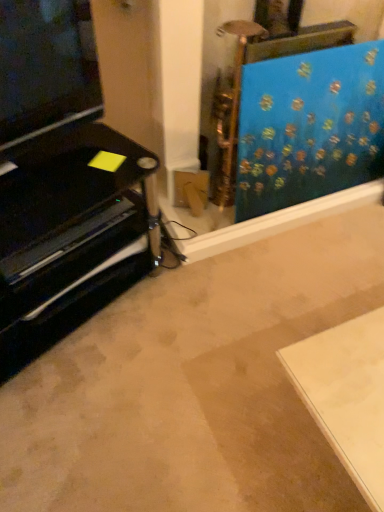
The width and height of the screenshot is (384, 512). Find the location of `blue fabric at upper right`. blue fabric at upper right is located at coordinates (309, 127).

Describe the element at coordinates (309, 127) in the screenshot. I see `blue fabric at upper right` at that location.

In order to face black glossy entertainment unit at left, should I rotate leftwards or rightwards?

Rotate left and turn 19.289 degrees.

Measure the distance between black glossy entertainment unit at left and camera.

The distance of black glossy entertainment unit at left from camera is 38.21 inches.

Where is `black glossy entertainment unit at left`? black glossy entertainment unit at left is located at coordinates (69, 232).

What do you see at coordinates (69, 232) in the screenshot? I see `black glossy entertainment unit at left` at bounding box center [69, 232].

This screenshot has width=384, height=512. Find the location of `blue fabric at upper right`. blue fabric at upper right is located at coordinates (309, 127).

Is blue fabric at upper right to the left of black glossy entertainment unit at left from the viewer's perspective?

No, blue fabric at upper right is not to the left of black glossy entertainment unit at left.

Which object is more forward, blue fabric at upper right or black glossy entertainment unit at left?

black glossy entertainment unit at left.

Which is more distant, (258,192) or (50,273)?

Positioned behind is point (258,192).

From the image's perspective, does blue fabric at upper right appear lower than black glossy entertainment unit at left?

No, from the image's perspective, blue fabric at upper right is not below black glossy entertainment unit at left.

From a real-world perspective, is blue fabric at upper right below black glossy entertainment unit at left?

No, from a real-world perspective, blue fabric at upper right is not below black glossy entertainment unit at left.

Consider the image. Looking at their sizes, would you say blue fabric at upper right is wider or thinner than black glossy entertainment unit at left?

Clearly, blue fabric at upper right has less width compared to black glossy entertainment unit at left.

Is blue fabric at upper right taller than black glossy entertainment unit at left?

Yes.

Considering the sizes of blue fabric at upper right and black glossy entertainment unit at left in the image, is blue fabric at upper right bigger or smaller than black glossy entertainment unit at left?

Considering their sizes, blue fabric at upper right takes up less space than black glossy entertainment unit at left.

Is black glossy entertainment unit at left inside blue fabric at upper right?

No, blue fabric at upper right does not contain black glossy entertainment unit at left.

Is blue fabric at upper right next to black glossy entertainment unit at left and touching it?

No, blue fabric at upper right is not with black glossy entertainment unit at left.

Is blue fabric at upper right facing away from black glossy entertainment unit at left?

No, blue fabric at upper right is not facing away from black glossy entertainment unit at left.

How many degrees apart are the facing directions of blue fabric at upper right and black glossy entertainment unit at left?

The angle between the facing direction of blue fabric at upper right and the facing direction of black glossy entertainment unit at left is 20.6 degrees.

How distant is blue fabric at upper right from black glossy entertainment unit at left?

blue fabric at upper right is 24.99 inches from black glossy entertainment unit at left.

This screenshot has width=384, height=512. Identify the location of furniture that appears in front of the blue fabric at upper right. (69, 232).

Is black glossy entertainment unit at left to the left of blue fabric at upper right from the viewer's perspective?

Indeed, black glossy entertainment unit at left is positioned on the left side of blue fabric at upper right.

Which object is closer to the camera taking this photo, black glossy entertainment unit at left or blue fabric at upper right?

black glossy entertainment unit at left is more forward.

Is point (60, 196) closer or farther from the camera than point (238, 161)?

Point (60, 196).

Based on the photo, from the image's perspective, is black glossy entertainment unit at left on blue fabric at upper right?

Incorrect, from the image's perspective, black glossy entertainment unit at left is lower than blue fabric at upper right.

From a real-world perspective, which object stands above the other?

From a 3D spatial view, blue fabric at upper right is above.

Looking at their sizes, would you say black glossy entertainment unit at left is wider or thinner than blue fabric at upper right?

In the image, black glossy entertainment unit at left appears to be wider than blue fabric at upper right.

Which of these two, black glossy entertainment unit at left or blue fabric at upper right, stands taller?

blue fabric at upper right is taller.

Which of these two, black glossy entertainment unit at left or blue fabric at upper right, is smaller?

Smaller between the two is blue fabric at upper right.

Is black glossy entertainment unit at left surrounding blue fabric at upper right?

No.

Are black glossy entertainment unit at left and blue fabric at upper right making contact?

black glossy entertainment unit at left and blue fabric at upper right are clearly separated.

Looking at this image, could you tell me if black glossy entertainment unit at left is facing blue fabric at upper right?

No, black glossy entertainment unit at left is not aimed at blue fabric at upper right.

What's the angular difference between black glossy entertainment unit at left and blue fabric at upper right's facing directions?

20.6 degrees.

How distant is black glossy entertainment unit at left from blue fabric at upper right?

24.99 inches.

What are the coordinates of `furniture that appears below the blue fabric at upper right (from the image's perspective)` in the screenshot? It's located at (69, 232).

The width and height of the screenshot is (384, 512). In the image, there is a black glossy entertainment unit at left. Find the location of `curtain above it (from the image's perspective)`. curtain above it (from the image's perspective) is located at coordinates (309, 127).

In order to click on curtain lying on the right of black glossy entertainment unit at left in this screenshot , I will do `click(309, 127)`.